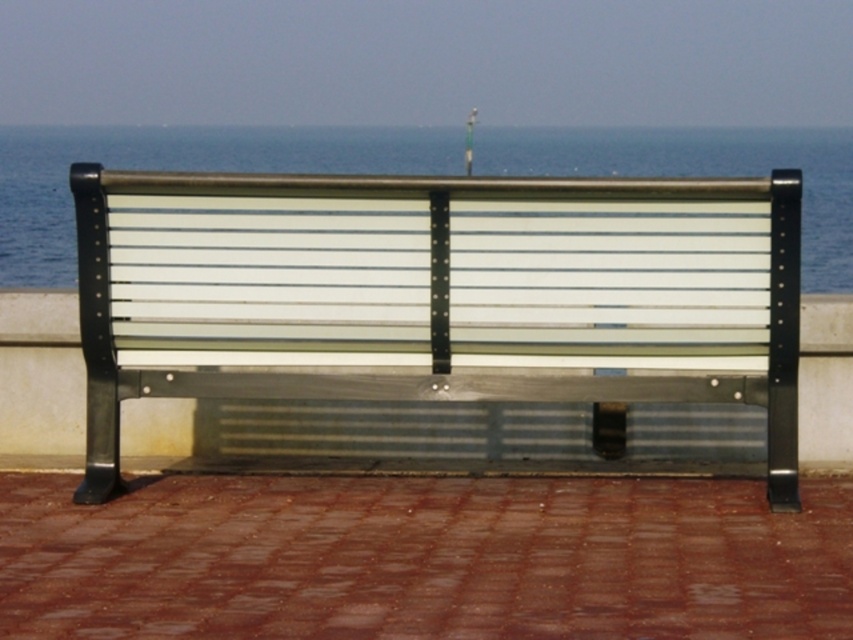
Question: Does metallic silver bench at center come behind transparent glass water at upper center?

Choices:
 (A) no
 (B) yes

Answer: (B)

Question: Is metallic silver bench at center smaller than transparent glass water at upper center?

Choices:
 (A) no
 (B) yes

Answer: (B)

Question: Is metallic silver bench at center to the left of transparent glass water at upper center from the viewer's perspective?

Choices:
 (A) yes
 (B) no

Answer: (B)

Question: Which point is farther to the camera?

Choices:
 (A) (0, 282)
 (B) (793, 291)

Answer: (A)